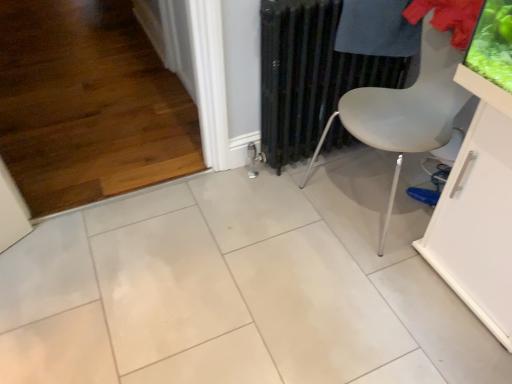
Question: Considering the relative positions of blue fabric shoe at lower right and black metal radiator at center in the image provided, is blue fabric shoe at lower right to the left of black metal radiator at center from the viewer's perspective?

Choices:
 (A) no
 (B) yes

Answer: (A)

Question: From a real-world perspective, is blue fabric shoe at lower right positioned over black metal radiator at center based on gravity?

Choices:
 (A) no
 (B) yes

Answer: (A)

Question: Is blue fabric shoe at lower right in contact with black metal radiator at center?

Choices:
 (A) no
 (B) yes

Answer: (A)

Question: From a real-world perspective, is blue fabric shoe at lower right physically below black metal radiator at center?

Choices:
 (A) no
 (B) yes

Answer: (B)

Question: Considering the relative sizes of blue fabric shoe at lower right and black metal radiator at center in the image provided, is blue fabric shoe at lower right wider than black metal radiator at center?

Choices:
 (A) no
 (B) yes

Answer: (A)

Question: Is point (462, 153) positioned closer to the camera than point (366, 24)?

Choices:
 (A) farther
 (B) closer

Answer: (B)

Question: In the image, is white glossy table at lower right positioned in front of or behind dark blue fabric at upper right?

Choices:
 (A) front
 (B) behind

Answer: (A)

Question: Considering the relative positions of white glossy table at lower right and dark blue fabric at upper right in the image provided, is white glossy table at lower right to the left or to the right of dark blue fabric at upper right?

Choices:
 (A) right
 (B) left

Answer: (A)

Question: In terms of height, does white glossy table at lower right look taller or shorter compared to dark blue fabric at upper right?

Choices:
 (A) short
 (B) tall

Answer: (B)

Question: From the image's perspective, relative to black metal radiator at center, is blue fabric shoe at lower right above or below?

Choices:
 (A) below
 (B) above

Answer: (A)

Question: Which is correct: blue fabric shoe at lower right is inside black metal radiator at center, or outside of it?

Choices:
 (A) inside
 (B) outside

Answer: (B)

Question: From a real-world perspective, is blue fabric shoe at lower right physically located above or below black metal radiator at center?

Choices:
 (A) below
 (B) above

Answer: (A)

Question: Does point (431, 200) appear closer or farther from the camera than point (368, 74)?

Choices:
 (A) farther
 (B) closer

Answer: (B)

Question: Considering the positions of black metal radiator at center and white glossy table at lower right in the image, is black metal radiator at center wider or thinner than white glossy table at lower right?

Choices:
 (A) thin
 (B) wide

Answer: (A)

Question: In terms of size, does black metal radiator at center appear bigger or smaller than white glossy table at lower right?

Choices:
 (A) small
 (B) big

Answer: (A)